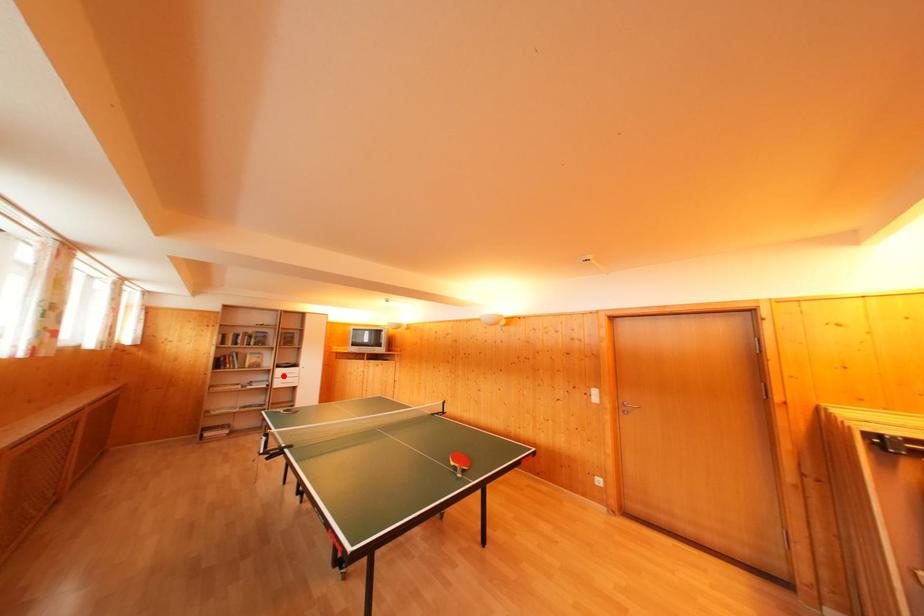
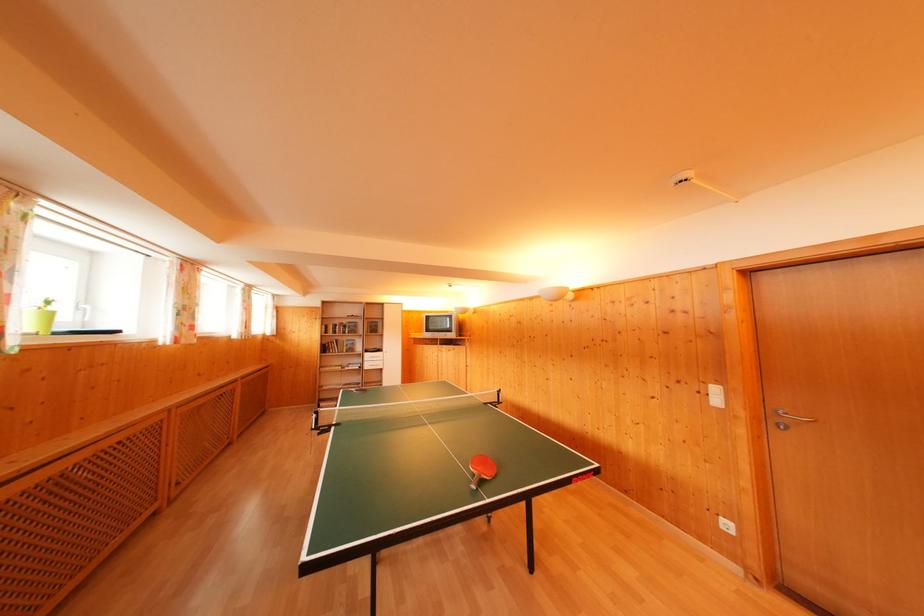
Question: I am providing you with two images of the same scene from different viewpoints. A red point is marked on the first image. Is the red point's position out of view in image 2?

Choices:
 (A) Yes
 (B) No

Answer: (B)